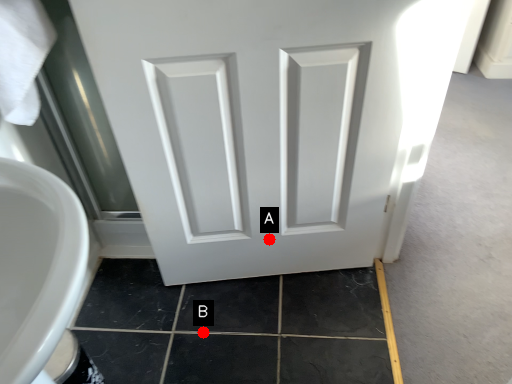
Question: Two points are circled on the image, labeled by A and B beside each circle. Which point appears closest to the camera in this image?

Choices:
 (A) A is closer
 (B) B is closer

Answer: (B)